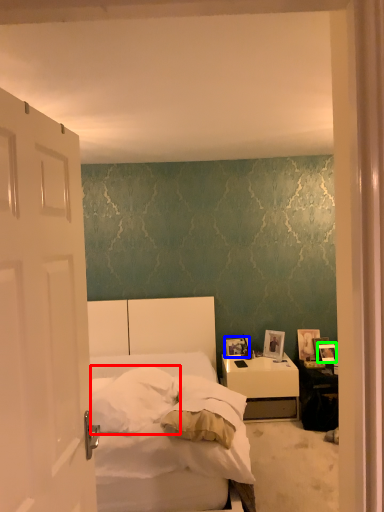
Question: Estimate the real-world distances between objects in this image. Which object is closer to pillow (highlighted by a red box), picture frame (highlighted by a blue box) or picture frame (highlighted by a green box)?

Choices:
 (A) picture frame
 (B) picture frame

Answer: (A)